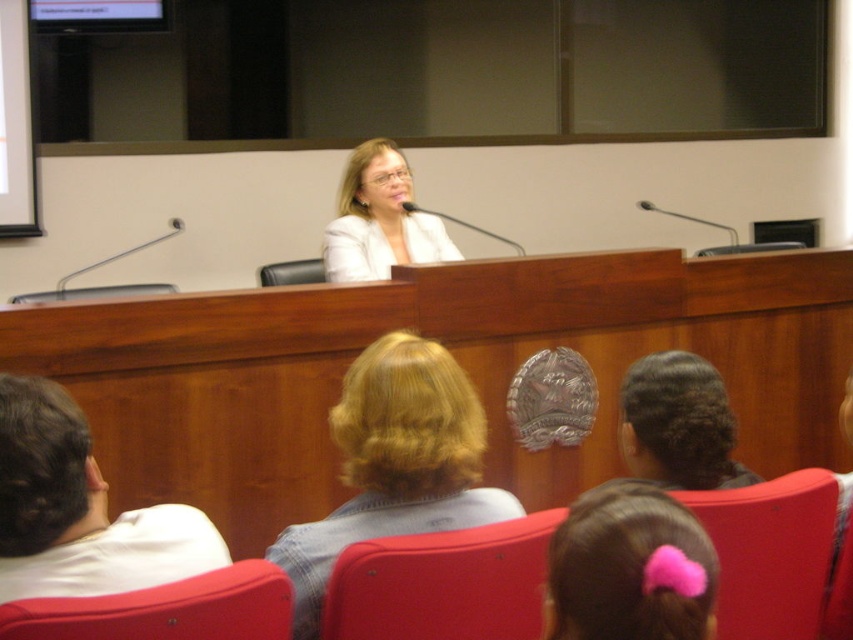
You are standing in the conference room and want to walk to the podium. There are two points marked on the floor. The first point is at coordinate point(322, 634) and the second point is at coordinate point(747, 243). Which point is closer to the camera?

Point(322, 634) is closer to the camera than point(747, 243).

You are a photographer in the back of the room. You want to take a photo of the blonde hair at center. Where should you aim your camera?

You should aim your camera at point 0.725 on the x axis and 0.464 on the y axis to capture the blonde hair at center.

You are a photographer in the audience and want to take a photo of the metallic silver microphone at left and the black leather chair at center. From your current position, which object is positioned to the right?

The black leather chair at center is positioned to the right of the metallic silver microphone at left.